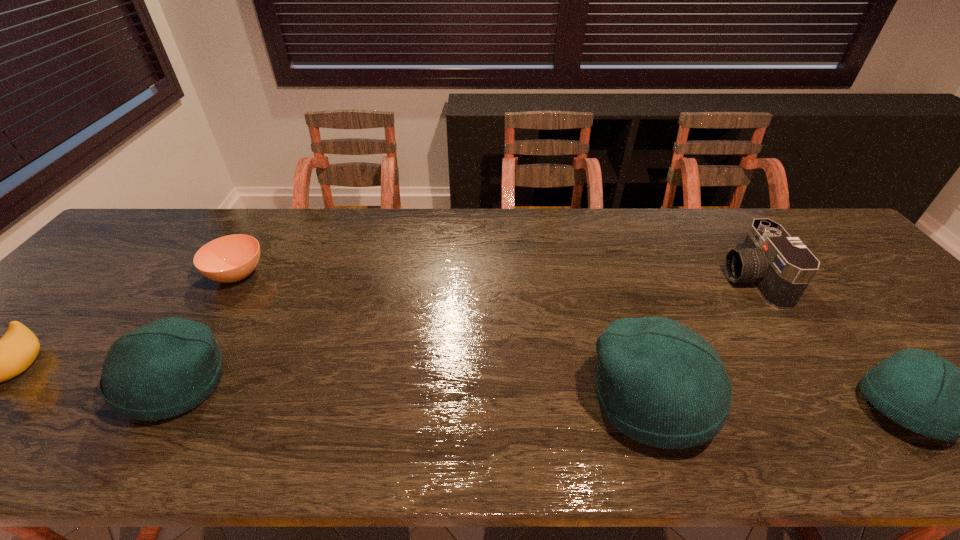
Choose which beanie is the nearest neighbor to the rightmost beanie. Please provide its 2D coordinates. Your answer should be formatted as a tuple, i.e. [(x, y)], where the tuple contains the x and y coordinates of a point satisfying the conditions above.

[(660, 383)]

In order to click on free space that satisfies the following two spatial constraints: 1. on the front side of the second beanie from left to right; 2. on the right side of the soup bowl in this screenshot , I will do `click(159, 401)`.